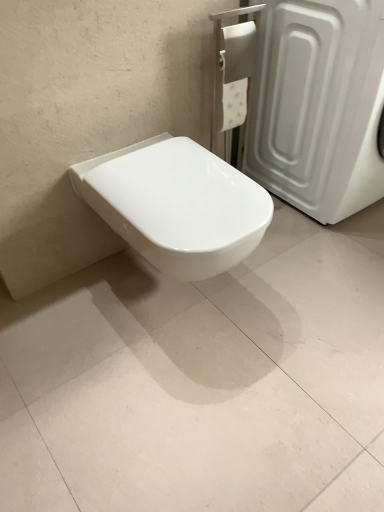
Locate an element on the screen. This screenshot has height=512, width=384. vacant space underneath white glossy toilet at center (from a real-world perspective) is located at coordinates click(x=189, y=301).